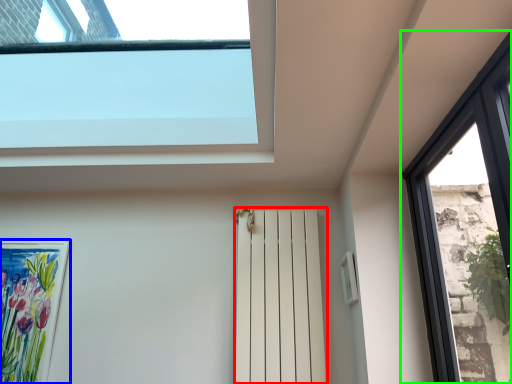
Question: Which is farther away from shutter (highlighted by a red box)? picture frame (highlighted by a blue box) or window (highlighted by a green box)?

Choices:
 (A) picture frame
 (B) window

Answer: (A)